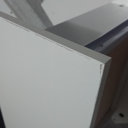
Where is `corner`? corner is located at coordinates (102, 64).